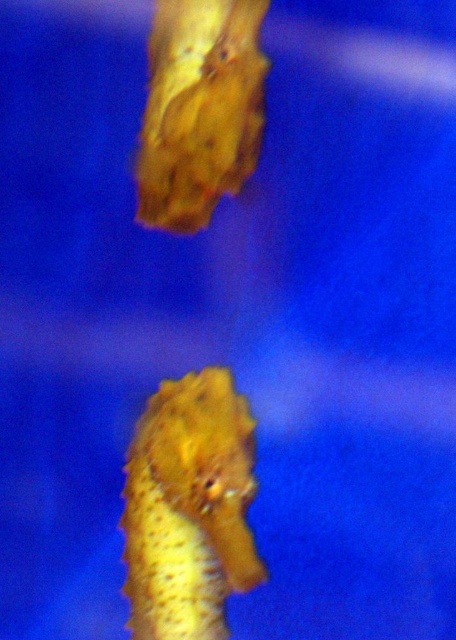
Question: Is yellow matte seahorse at center thinner than yellow textured seahorse at upper center?

Choices:
 (A) no
 (B) yes

Answer: (A)

Question: Which point appears farthest from the camera in this image?

Choices:
 (A) (182, 195)
 (B) (174, 525)

Answer: (A)

Question: Which point is closer to the camera?

Choices:
 (A) yellow textured seahorse at upper center
 (B) yellow matte seahorse at center

Answer: (B)

Question: Does yellow matte seahorse at center appear on the left side of yellow textured seahorse at upper center?

Choices:
 (A) yes
 (B) no

Answer: (A)

Question: Can you confirm if yellow matte seahorse at center is positioned to the left of yellow textured seahorse at upper center?

Choices:
 (A) yes
 (B) no

Answer: (A)